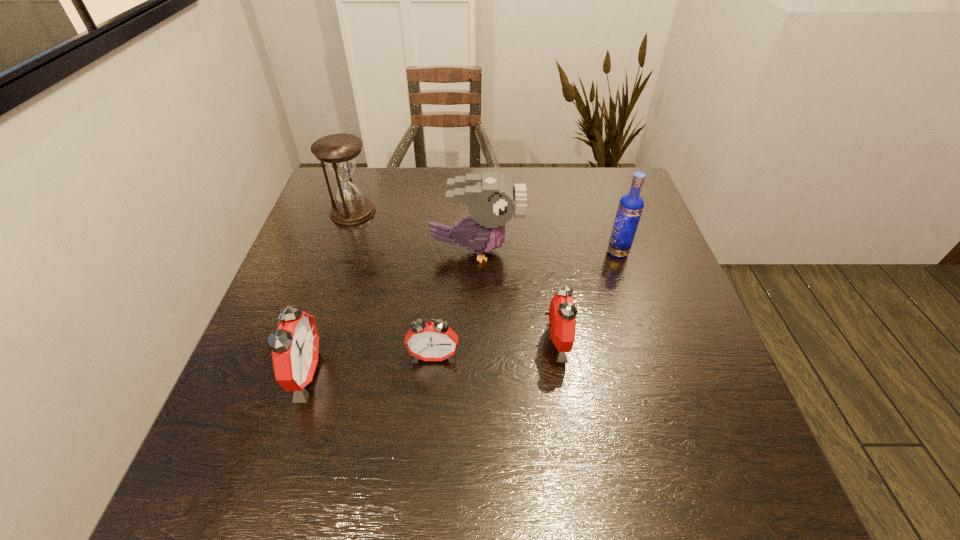
Find the location of `the closest alarm clock to the shortest alarm clock`. the closest alarm clock to the shortest alarm clock is located at coordinates (295, 347).

Find the location of a particular element. The width and height of the screenshot is (960, 540). vacant region that satisfies the following two spatial constraints: 1. on the clock face of the fifth tallest object; 2. on the clock face of the shortest object is located at coordinates (558, 356).

Where is `free space that satisfies the following two spatial constraints: 1. at the beak of the bird; 2. on the right side of the vodka`? free space that satisfies the following two spatial constraints: 1. at the beak of the bird; 2. on the right side of the vodka is located at coordinates point(476,253).

Locate an element on the screen. The height and width of the screenshot is (540, 960). free space that satisfies the following two spatial constraints: 1. on the clock face of the fifth tallest object; 2. on the clock face of the shortest alarm clock is located at coordinates (558, 356).

The height and width of the screenshot is (540, 960). I want to click on vacant region that satisfies the following two spatial constraints: 1. on the clock face of the shortest alarm clock; 2. on the clock face of the leftmost alarm clock, so click(x=432, y=374).

Where is `vacant space that satisfies the following two spatial constraints: 1. at the beak of the bird; 2. on the clock face of the second alarm clock from left to right`? vacant space that satisfies the following two spatial constraints: 1. at the beak of the bird; 2. on the clock face of the second alarm clock from left to right is located at coordinates (475, 356).